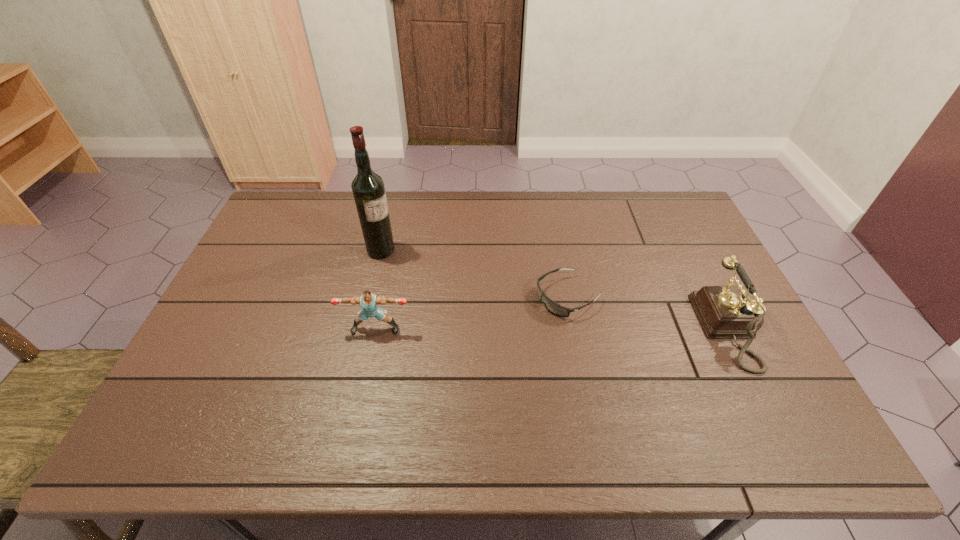
Locate an element on the screen. The width and height of the screenshot is (960, 540). vacant spot on the desktop that is between the puncher and the telephone and is positioned on the front and back of the farthest object is located at coordinates (536, 329).

Find the location of a particular element. free space on the desktop that is between the puncher and the telephone and is positioned on the lenses of the shortest object is located at coordinates (504, 329).